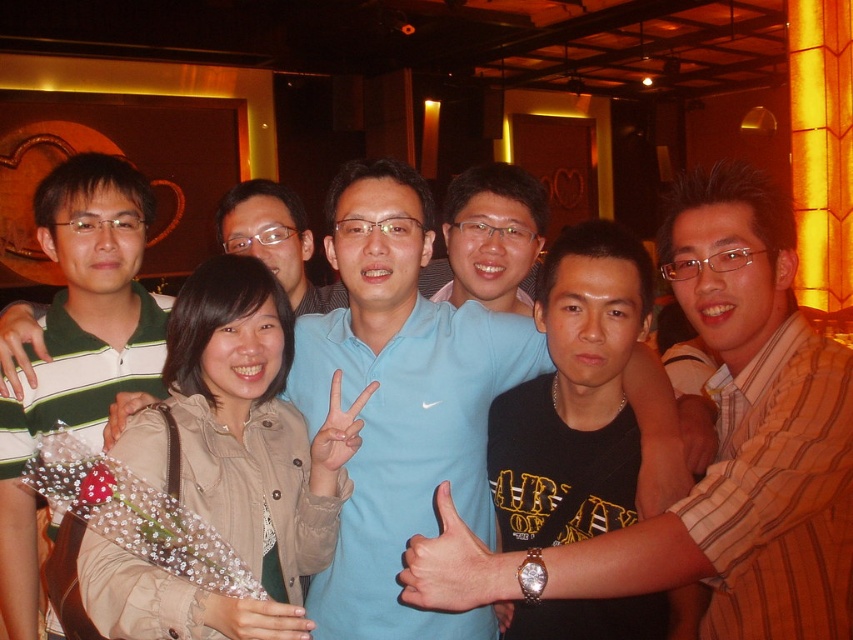
Question: Is the position of blue shirt at center less distant than that of green striped polo shirt at left?

Choices:
 (A) no
 (B) yes

Answer: (B)

Question: Which object appears farthest from the camera in this image?

Choices:
 (A) green striped polo shirt at left
 (B) blue shirt at center
 (C) tan fabric jacket at center

Answer: (A)

Question: Is tan fabric jacket at center bigger than green striped polo shirt at left?

Choices:
 (A) no
 (B) yes

Answer: (B)

Question: From the image, what is the correct spatial relationship of blue shirt at center in relation to green striped polo shirt at left?

Choices:
 (A) right
 (B) left

Answer: (A)

Question: Which object is the farthest from the tan fabric jacket at center?

Choices:
 (A) blue shirt at center
 (B) green striped polo shirt at left

Answer: (B)

Question: Which point appears closest to the camera in this image?

Choices:
 (A) (142, 316)
 (B) (215, 509)

Answer: (B)